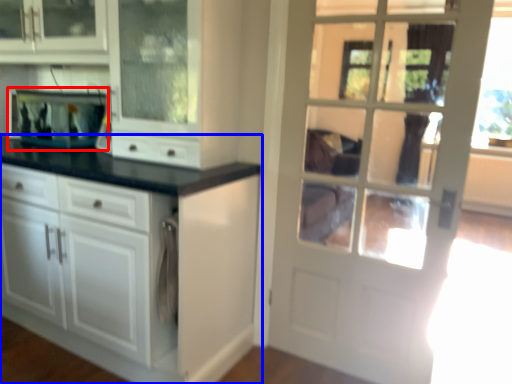
Question: Which of the following is the closest to the observer, appliance (highlighted by a red box) or cabinetry (highlighted by a blue box)?

Choices:
 (A) appliance
 (B) cabinetry

Answer: (B)